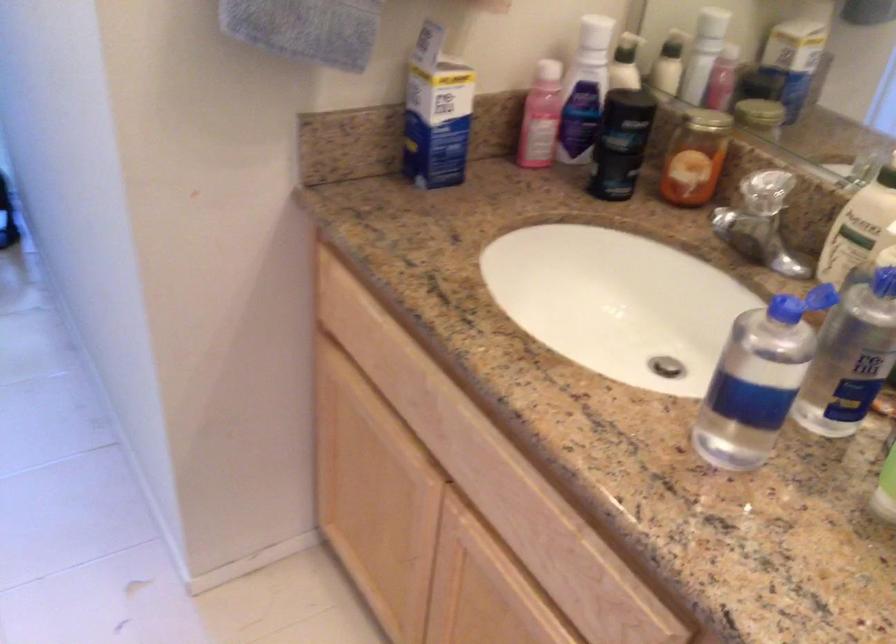
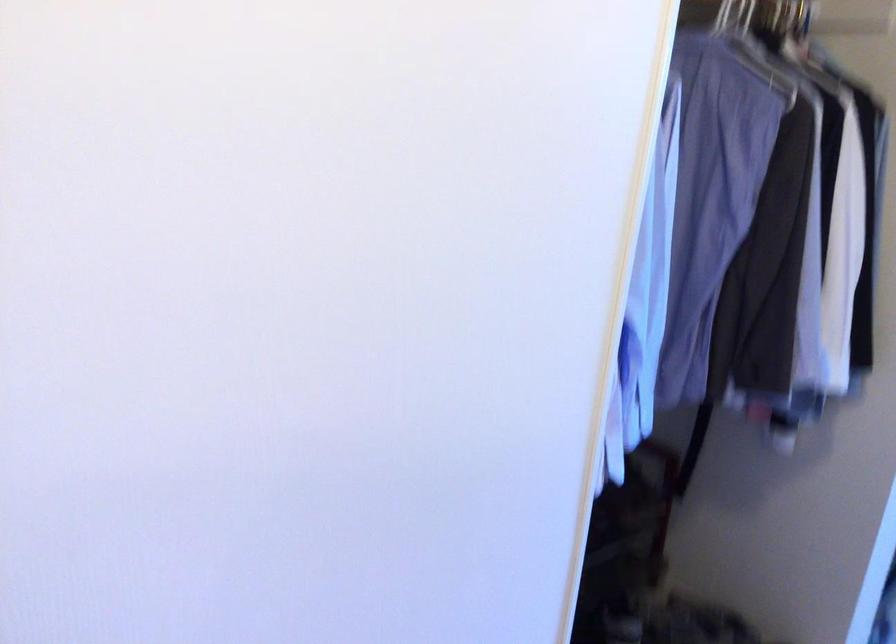
Question: The images are taken continuously from a first-person perspective. In which direction is your viewpoint rotating?

Choices:
 (A) Left
 (B) Right
 (C) Up
 (D) Down

Answer: (A)